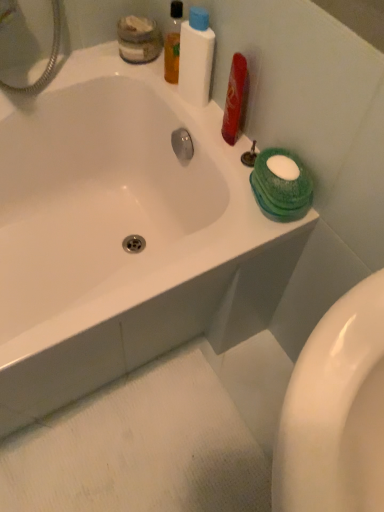
Question: Does translucent plastic mouthwash at upper center appear on the right side of matte glass jar at upper left?

Choices:
 (A) yes
 (B) no

Answer: (A)

Question: Is translucent plastic mouthwash at upper center looking in the opposite direction of matte glass jar at upper left?

Choices:
 (A) yes
 (B) no

Answer: (B)

Question: Is translucent plastic mouthwash at upper center positioned behind matte glass jar at upper left?

Choices:
 (A) no
 (B) yes

Answer: (A)

Question: Is translucent plastic mouthwash at upper center bigger than matte glass jar at upper left?

Choices:
 (A) yes
 (B) no

Answer: (B)

Question: Does translucent plastic mouthwash at upper center have a lesser height compared to matte glass jar at upper left?

Choices:
 (A) no
 (B) yes

Answer: (A)

Question: Is point (192, 52) positioned closer to the camera than point (304, 243)?

Choices:
 (A) closer
 (B) farther

Answer: (B)

Question: Considering their positions, is white plastic bottle at upper center located in front of or behind white glossy bathtub at upper center?

Choices:
 (A) behind
 (B) front

Answer: (A)

Question: Is white plastic bottle at upper center to the left or to the right of white glossy bathtub at upper center in the image?

Choices:
 (A) right
 (B) left

Answer: (A)

Question: From their relative heights in the image, would you say white plastic bottle at upper center is taller or shorter than white glossy bathtub at upper center?

Choices:
 (A) short
 (B) tall

Answer: (A)

Question: Is matte glass jar at upper left wider or thinner than white glossy bathtub at upper center?

Choices:
 (A) thin
 (B) wide

Answer: (A)

Question: Is matte glass jar at upper left situated inside white glossy bathtub at upper center or outside?

Choices:
 (A) inside
 (B) outside

Answer: (A)

Question: From the image's perspective, is matte glass jar at upper left located above or below white glossy bathtub at upper center?

Choices:
 (A) above
 (B) below

Answer: (A)

Question: Relative to white glossy bathtub at upper center, is matte glass jar at upper left in front or behind?

Choices:
 (A) front
 (B) behind

Answer: (B)

Question: Considering the relative positions of white plastic bottle at upper center and matte glass jar at upper left in the image provided, is white plastic bottle at upper center to the left or to the right of matte glass jar at upper left?

Choices:
 (A) left
 (B) right

Answer: (B)

Question: Considering the positions of white plastic bottle at upper center and matte glass jar at upper left in the image, is white plastic bottle at upper center bigger or smaller than matte glass jar at upper left?

Choices:
 (A) small
 (B) big

Answer: (A)